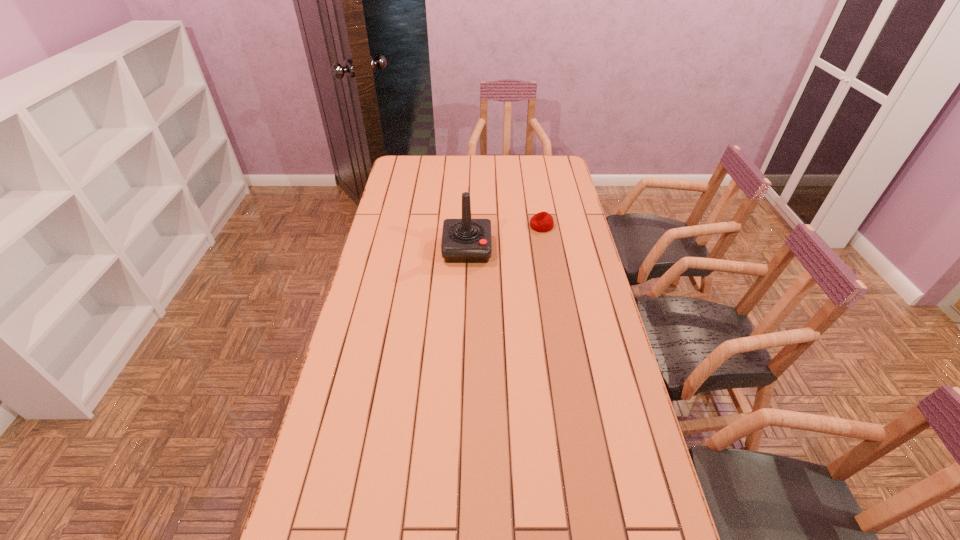
Where is `vacant space that satisfies the following two spatial constraints: 1. on the seat area of the farther object; 2. on the front-facing side of the taller object`? vacant space that satisfies the following two spatial constraints: 1. on the seat area of the farther object; 2. on the front-facing side of the taller object is located at coordinates (545, 249).